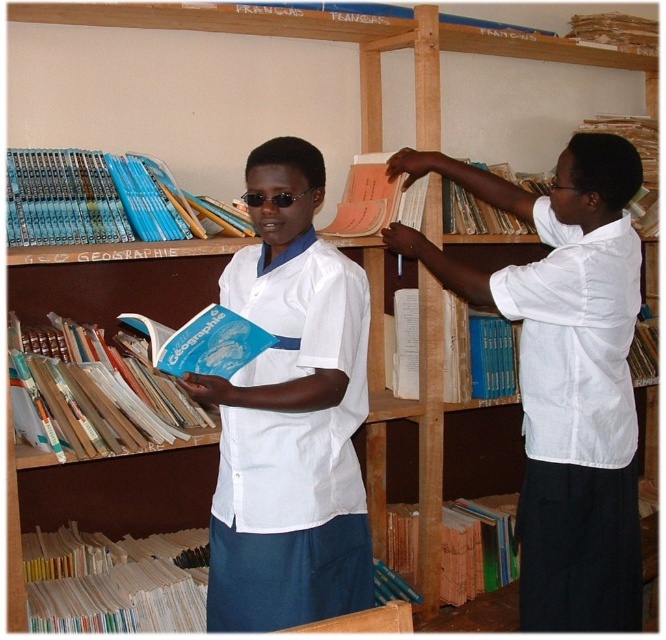
Question: Which of the following is the farthest from the observer?

Choices:
 (A) (450, 536)
 (B) (446, 227)
 (C) (151, 220)
 (D) (573, 538)

Answer: (A)

Question: Which object is closer to the camera taking this photo?

Choices:
 (A) matte paper book at upper right
 (B) blue paper book at center
 (C) white matte shirt at upper right
 (D) blue paper book at lower center

Answer: (C)

Question: Is blue matte book at center wider than wooden book at center?

Choices:
 (A) no
 (B) yes

Answer: (B)

Question: Is blue matte book at center to the left of blue hardcover book at center from the viewer's perspective?

Choices:
 (A) yes
 (B) no

Answer: (A)

Question: Can you confirm if blue hardcover book at center is smaller than blue paper book at lower center?

Choices:
 (A) yes
 (B) no

Answer: (B)

Question: Which object appears farthest from the camera in this image?

Choices:
 (A) blue paperbacks at upper left
 (B) blue paper book at center

Answer: (A)